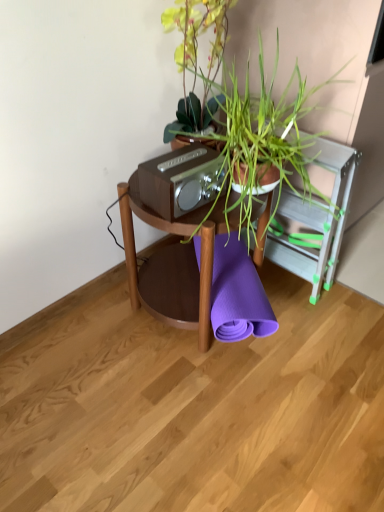
Question: Is green leafy plant at center taller than matte brown stereo at center?

Choices:
 (A) yes
 (B) no

Answer: (A)

Question: Is matte brown stereo at center at the back of green leafy plant at center?

Choices:
 (A) yes
 (B) no

Answer: (A)

Question: Is green leafy plant at center closer to the viewer compared to matte brown stereo at center?

Choices:
 (A) yes
 (B) no

Answer: (A)

Question: Is green leafy plant at center to the right of matte brown stereo at center from the viewer's perspective?

Choices:
 (A) no
 (B) yes

Answer: (B)

Question: From a real-world perspective, is green leafy plant at center positioned over matte brown stereo at center based on gravity?

Choices:
 (A) yes
 (B) no

Answer: (A)

Question: Looking at their shapes, would you say green leafy plant at center is wider or thinner than matte brown stereo at center?

Choices:
 (A) wide
 (B) thin

Answer: (A)

Question: Would you say green leafy plant at center is inside or outside matte brown stereo at center?

Choices:
 (A) inside
 (B) outside

Answer: (B)

Question: Is point (167, 30) closer or farther from the camera than point (195, 199)?

Choices:
 (A) closer
 (B) farther

Answer: (B)

Question: Considering their positions, is green leafy plant at center located in front of or behind matte brown stereo at center?

Choices:
 (A) front
 (B) behind

Answer: (A)

Question: Is point (205, 229) closer or farther from the camera than point (152, 169)?

Choices:
 (A) farther
 (B) closer

Answer: (B)

Question: From the image's perspective, relative to matte brown stereo at center, is woodenmaterial/texturetable at center above or below?

Choices:
 (A) below
 (B) above

Answer: (A)

Question: Looking at their shapes, would you say woodenmaterial/texturetable at center is wider or thinner than matte brown stereo at center?

Choices:
 (A) wide
 (B) thin

Answer: (A)

Question: Visually, is woodenmaterial/texturetable at center positioned to the left or to the right of matte brown stereo at center?

Choices:
 (A) left
 (B) right

Answer: (B)

Question: Looking at the image, does woodenmaterial/texturetable at center seem bigger or smaller compared to green leafy plant at center?

Choices:
 (A) big
 (B) small

Answer: (B)

Question: Is woodenmaterial/texturetable at center in front of or behind green leafy plant at center in the image?

Choices:
 (A) front
 (B) behind

Answer: (B)